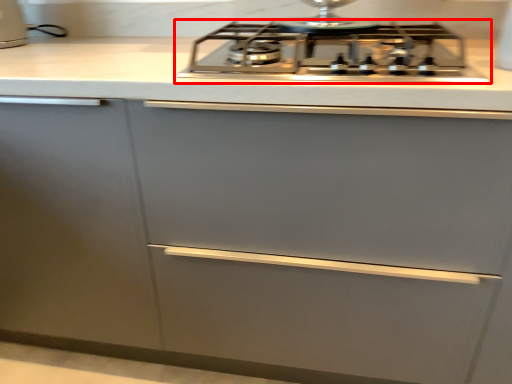
Question: From the image's perspective, what is the correct spatial relationship of gas stove (annotated by the red box) in relation to kitchen appliance?

Choices:
 (A) above
 (B) below

Answer: (B)